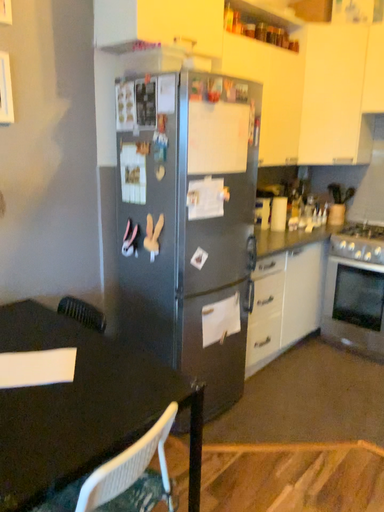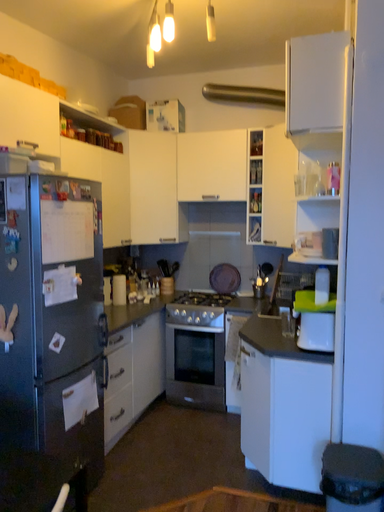
Question: Which way did the camera rotate in the video?

Choices:
 (A) rotated left
 (B) rotated right

Answer: (B)